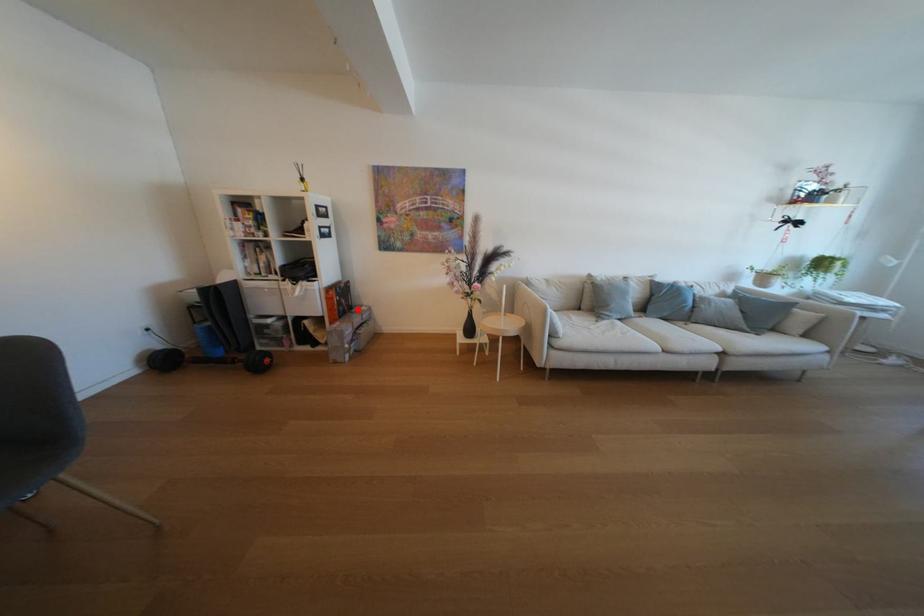
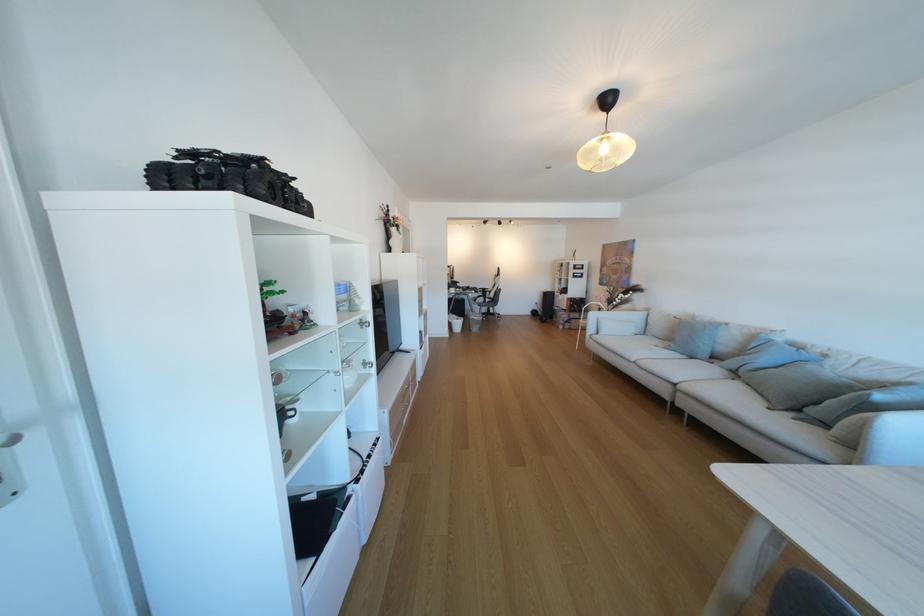
Find the pixel in the second image that matches the highlighted location in the first image.

(589, 310)